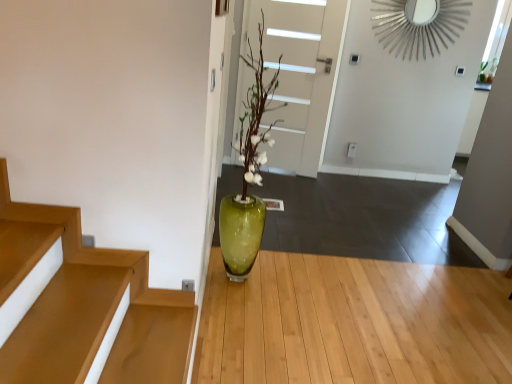
Question: Considering the relative positions of green glass vase at center and white matte door at center in the image provided, is green glass vase at center to the right of white matte door at center from the viewer's perspective?

Choices:
 (A) yes
 (B) no

Answer: (A)

Question: Can you confirm if green glass vase at center is thinner than white matte door at center?

Choices:
 (A) yes
 (B) no

Answer: (B)

Question: Could white matte door at center be considered to be inside green glass vase at center?

Choices:
 (A) no
 (B) yes

Answer: (A)

Question: Is green glass vase at center wider than white matte door at center?

Choices:
 (A) yes
 (B) no

Answer: (A)

Question: Does green glass vase at center touch white matte door at center?

Choices:
 (A) no
 (B) yes

Answer: (A)

Question: Visually, is white matte door at center positioned to the left or to the right of green glass vase at center?

Choices:
 (A) left
 (B) right

Answer: (A)

Question: From a real-world perspective, is white matte door at center positioned above or below green glass vase at center?

Choices:
 (A) above
 (B) below

Answer: (A)

Question: Is white matte door at center inside the boundaries of green glass vase at center, or outside?

Choices:
 (A) inside
 (B) outside

Answer: (B)

Question: Considering the positions of white matte door at center and green glass vase at center in the image, is white matte door at center bigger or smaller than green glass vase at center?

Choices:
 (A) big
 (B) small

Answer: (B)

Question: From a real-world perspective, is green glass vase at center physically located above or below green glass vase at center?

Choices:
 (A) below
 (B) above

Answer: (A)

Question: Considering the relative positions of green glass vase at center and green glass vase at center in the image provided, is green glass vase at center to the left or to the right of green glass vase at center?

Choices:
 (A) left
 (B) right

Answer: (B)

Question: Is green glass vase at center wider or thinner than green glass vase at center?

Choices:
 (A) wide
 (B) thin

Answer: (A)

Question: In terms of height, does green glass vase at center look taller or shorter compared to green glass vase at center?

Choices:
 (A) tall
 (B) short

Answer: (B)

Question: Choose the correct answer: Is green glass vase at center inside white matte door at center or outside it?

Choices:
 (A) outside
 (B) inside

Answer: (A)

Question: Looking at their shapes, would you say green glass vase at center is wider or thinner than white matte door at center?

Choices:
 (A) thin
 (B) wide

Answer: (B)